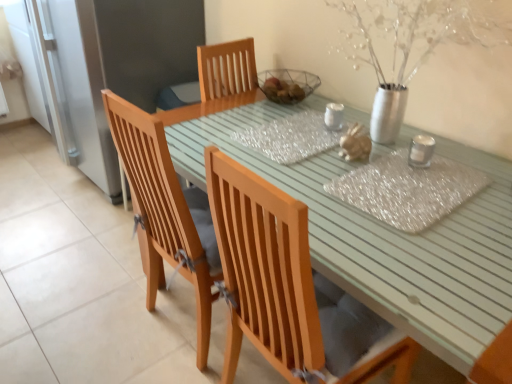
Question: Does clear plastic placemat at center have a lesser height compared to translucent glass jar at center?

Choices:
 (A) no
 (B) yes

Answer: (B)

Question: From a real-world perspective, is clear plastic placemat at center under translucent glass jar at center?

Choices:
 (A) yes
 (B) no

Answer: (A)

Question: Is translucent glass jar at center surrounded by clear plastic placemat at center?

Choices:
 (A) yes
 (B) no

Answer: (B)

Question: Are clear plastic placemat at center and translucent glass jar at center far apart?

Choices:
 (A) yes
 (B) no

Answer: (B)

Question: Can you confirm if clear plastic placemat at center is positioned to the right of translucent glass jar at center?

Choices:
 (A) yes
 (B) no

Answer: (A)

Question: Can you confirm if clear plastic placemat at center is smaller than translucent glass jar at center?

Choices:
 (A) no
 (B) yes

Answer: (A)

Question: From the image's perspective, is wooden chair at center, the first chair ordered from the bottom, located above clear plastic placemat at center?

Choices:
 (A) yes
 (B) no

Answer: (B)

Question: Can you confirm if wooden chair at center, positioned as the 2th chair in top-to-bottom order, is wider than clear plastic placemat at center?

Choices:
 (A) yes
 (B) no

Answer: (B)

Question: Considering the relative positions of wooden chair at center, positioned as the 2th chair in top-to-bottom order, and clear plastic placemat at center in the image provided, is wooden chair at center, positioned as the 2th chair in top-to-bottom order, to the left of clear plastic placemat at center from the viewer's perspective?

Choices:
 (A) no
 (B) yes

Answer: (B)

Question: Is wooden chair at center, positioned as the 2th chair in top-to-bottom order, far away from clear plastic placemat at center?

Choices:
 (A) no
 (B) yes

Answer: (A)

Question: Does wooden chair at center, the first chair ordered from the bottom, turn towards clear plastic placemat at center?

Choices:
 (A) yes
 (B) no

Answer: (B)

Question: From a real-world perspective, is wooden chair at center, positioned as the 2th chair in top-to-bottom order, on clear plastic placemat at center?

Choices:
 (A) no
 (B) yes

Answer: (A)

Question: Can you confirm if wooden chair at center, which is the 1th chair in top-to-bottom order, is thinner than translucent glass jar at center?

Choices:
 (A) yes
 (B) no

Answer: (B)